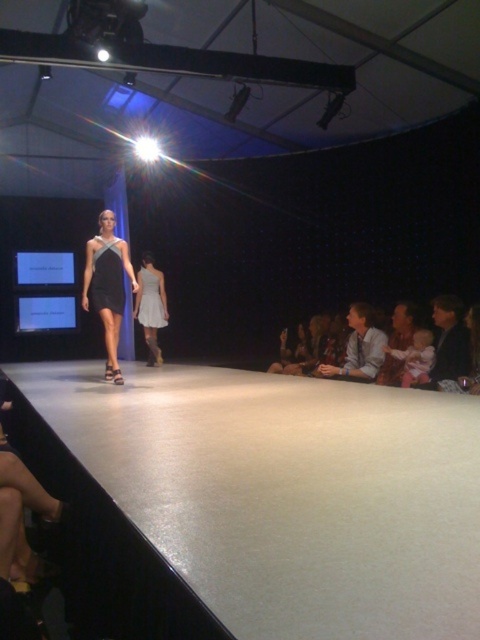
Which is more to the left, satin black dress at center or light brown leather jacket at lower right?

satin black dress at center is more to the left.

Is satin black dress at center bigger than light brown leather jacket at lower right?

Yes.

From the picture: Who is more forward, (108,291) or (326,368)?

Point (326,368)

Where is `satin black dress at center`? The height and width of the screenshot is (640, 480). satin black dress at center is located at coordinates [x=108, y=285].

Can you confirm if dark blue fabric at lower right is wider than satin dress at center?

No, dark blue fabric at lower right is not wider than satin dress at center.

Can you confirm if dark blue fabric at lower right is positioned below satin dress at center?

Correct, dark blue fabric at lower right is located below satin dress at center.

Is point (459, 328) more distant than point (141, 269)?

That is False.

The width and height of the screenshot is (480, 640). Find the location of `dark blue fabric at lower right`. dark blue fabric at lower right is located at coordinates (450, 339).

Is black satin dress at center positioned before satin dress at center?

Yes, it is in front of satin dress at center.

Between black satin dress at center and satin dress at center, which one is positioned lower?

satin dress at center

Between point (94, 280) and point (141, 298), which one is positioned behind?

Positioned behind is point (141, 298).

This screenshot has height=640, width=480. I want to click on black satin dress at center, so click(x=108, y=276).